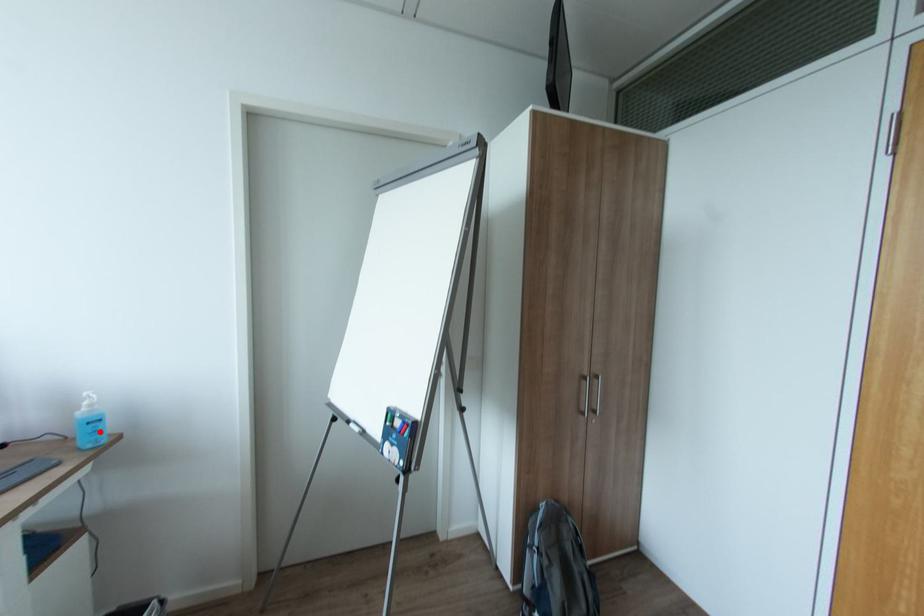
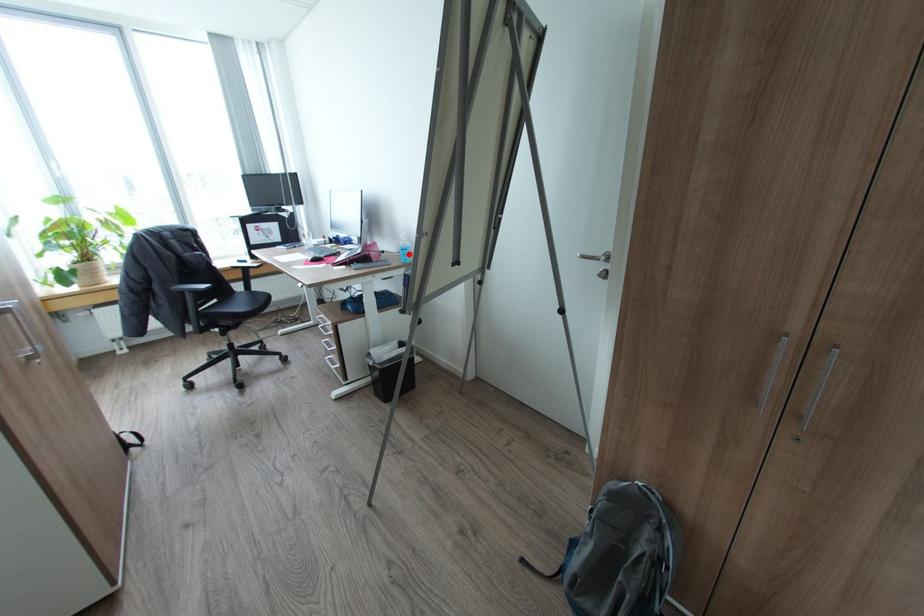
I am providing you with two images of the same scene from different viewpoints. A red point is marked on the first image and another point is marked on the second image. Is the red point in image1 aligned with the point shown in image2?

Yes